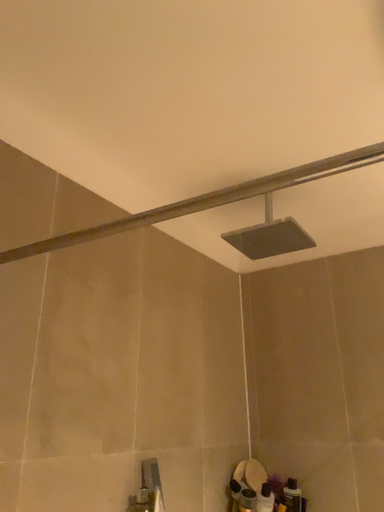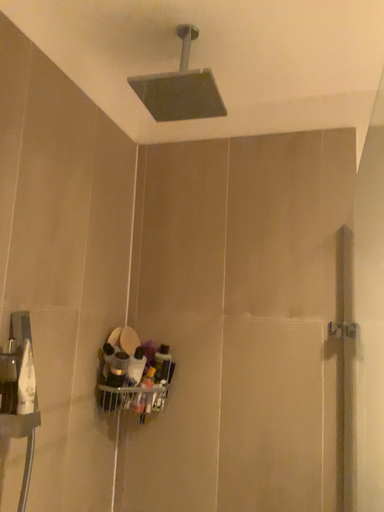
Question: How did the camera likely rotate when shooting the video?

Choices:
 (A) rotated right
 (B) rotated left

Answer: (A)